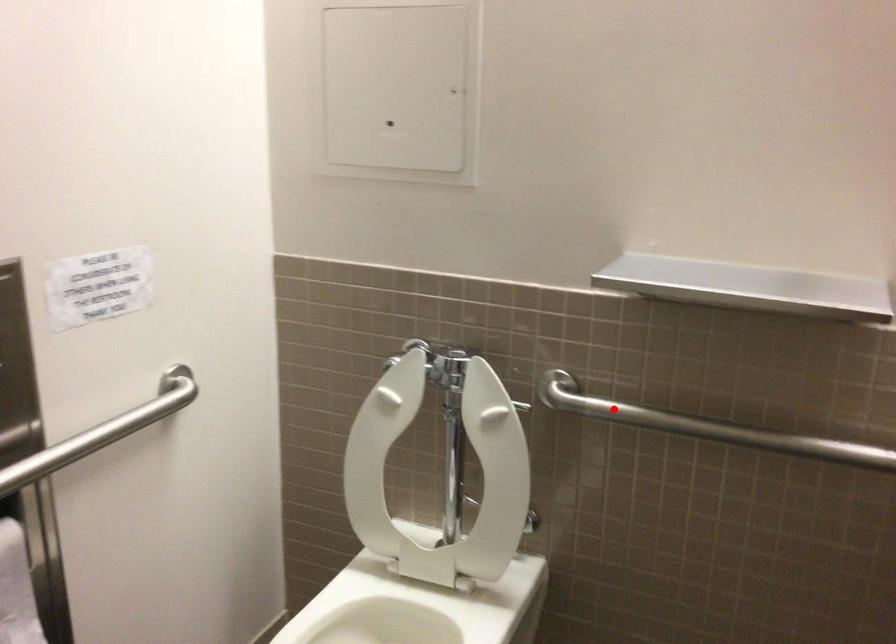
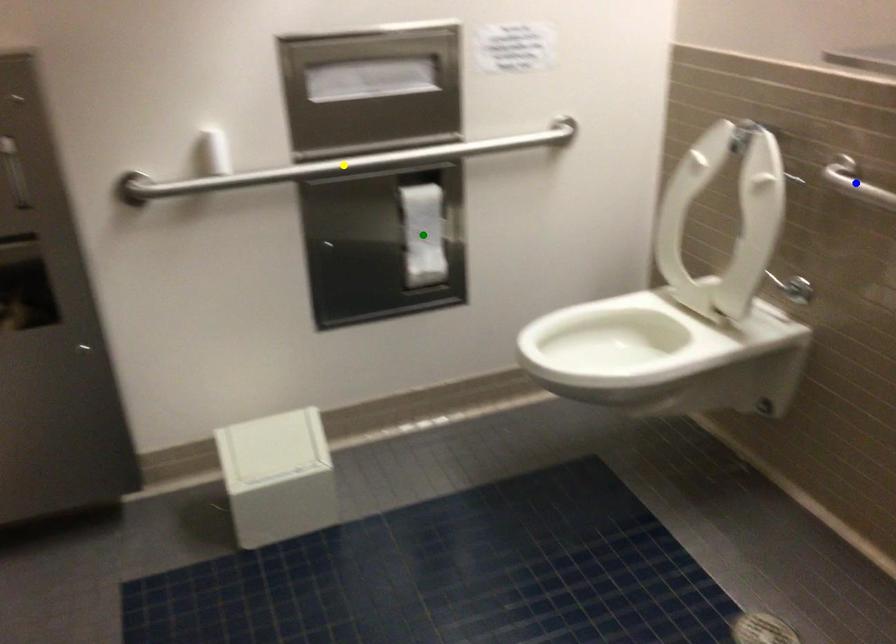
Question: I am providing you with two images of the same scene from different viewpoints. A red point is marked on the first image. You are given multiple points on the second image. Can you choose the point in image 2 that corresponds to the point in image 1?

Choices:
 (A) blue point
 (B) yellow point
 (C) green point

Answer: (A)